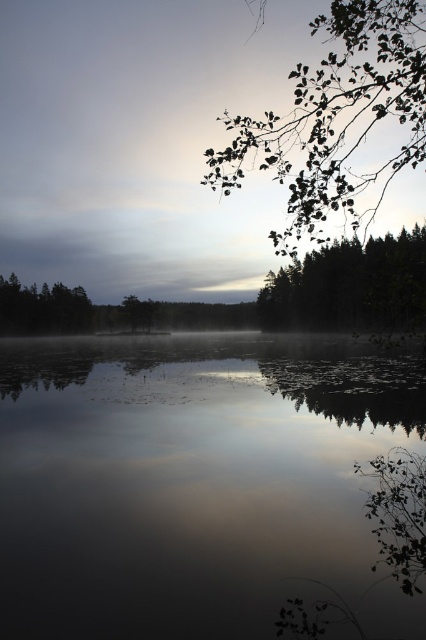
Question: Among these points, which one is farthest from the camera?

Choices:
 (A) (356, 298)
 (B) (244, 616)
 (C) (5, 108)
 (D) (365, 68)

Answer: (C)

Question: Is smooth reflective water at center above transparent mist at center?

Choices:
 (A) yes
 (B) no

Answer: (B)

Question: Can you confirm if smooth reflective water at center is smaller than green leafy branches at upper right?

Choices:
 (A) no
 (B) yes

Answer: (B)

Question: Which object appears farthest from the camera in this image?

Choices:
 (A) green leafy branches at upper right
 (B) smooth reflective water at center
 (C) transparent mist at center
 (D) green leafy tree at upper right

Answer: (C)

Question: Where is transparent mist at center located in relation to green leafy branches at upper right in the image?

Choices:
 (A) left
 (B) right

Answer: (A)

Question: Which point is closer to the camera?

Choices:
 (A) (279, 452)
 (B) (416, 20)
 (C) (402, 234)
 (D) (106, 250)

Answer: (A)